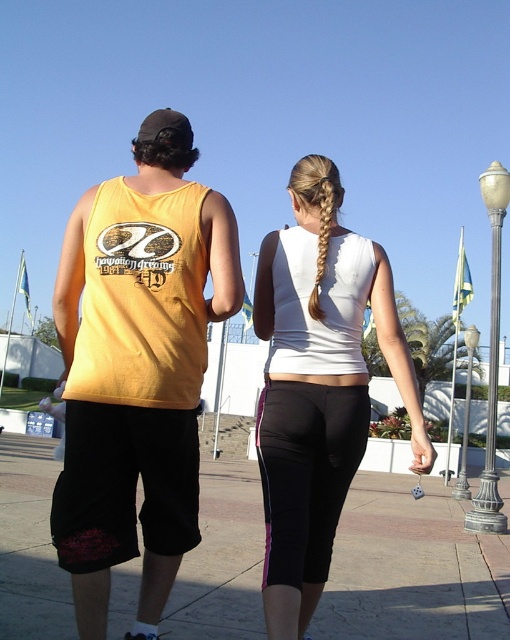
Based on the scene description, where is the yellow cotton tank top at left located in the image? Please provide the coordinates in the format of point followed by the coordinate values.

The yellow cotton tank top at left is located at point (137, 364).

You are standing at the camera position and see two people walking away from you. The person on the left is wearing a yellow sleeveless shirt with a graphic design on the back. The person on the right is wearing a white sleeveless top and black leggings with pink accents. There is a point at coordinates [137,364]. Which object does this point correspond to?

The point at coordinates [137,364] corresponds to the yellow cotton tank top at left.